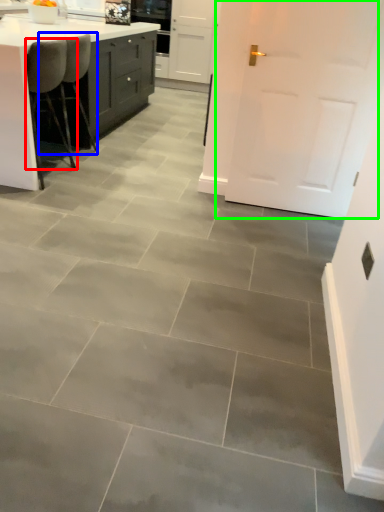
Question: Which object is positioned farthest from chair (highlighted by a red box)? Select from chair (highlighted by a blue box) and door (highlighted by a green box).

Choices:
 (A) chair
 (B) door

Answer: (B)